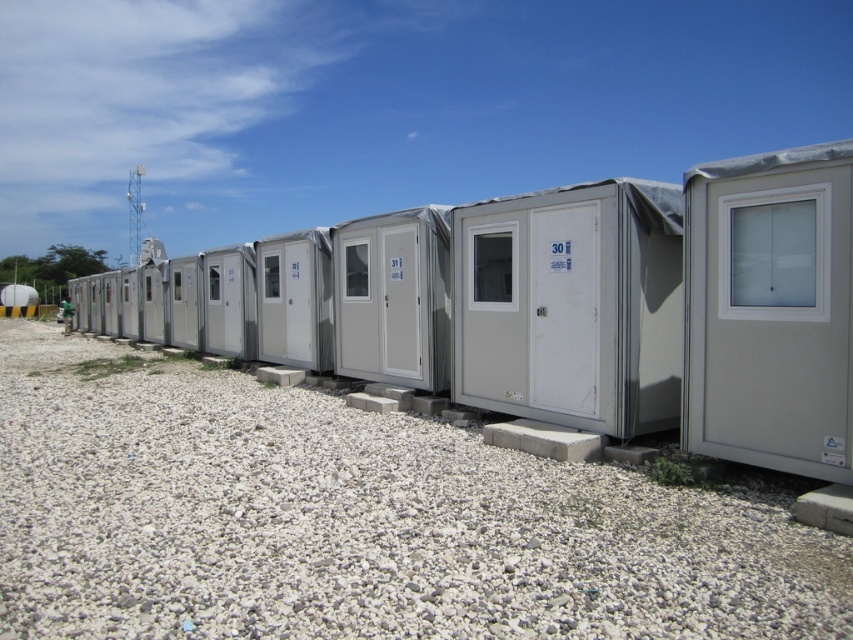
You are a delivery person who needs to park your 6.5 feet wide delivery truck between the white gravel at lower center and the matte gray container at center. Can you fit the truck in that space?

The white gravel at lower center is 7.38 feet from the matte gray container at center. Since the truck is 6.5 feet wide, it can fit in the space between them as the distance is greater than the truck width.

You are a delivery person trying to park your 2.5 meter tall delivery van in the area near the white gravel at lower center and the matte gray container at center. Can your van fit vertically between them without hitting anything?

The white gravel at lower center is not as tall as matte gray container at center. The tallest object here is the matte gray container at center, which is taller than the white gravel. Since your van is 2.5 meters tall, you need to ensure there is enough vertical clearance. If the matte gray container at center is taller than 2.5 meters, then the van can pass under it. However, without specific height measurements for the container, it is uncertain. Please check the actual height of the matte gray container

You are a delivery driver who needs to park your truck, which is 2 meters wide, between the white gravel at lower center and the matte gray container at center. Can your truck fit in the space between them?

The white gravel at lower center is bigger than the matte gray container at center, so the space between them is not wide enough to accommodate a truck that is 2 meters wide.